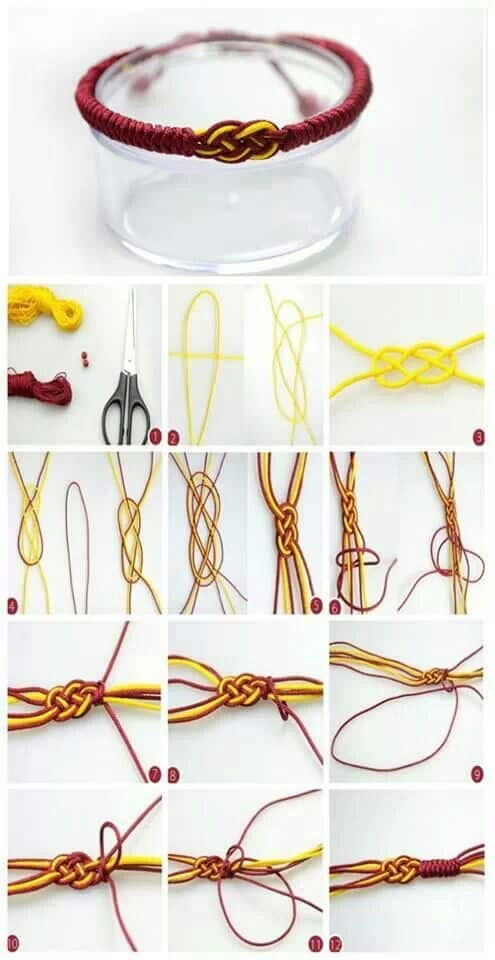
At what (x,y) coordinates should I click in order to perform the action: click on glass container. Please return your answer as a coordinate pair (x, y). Looking at the image, I should click on (275, 185).